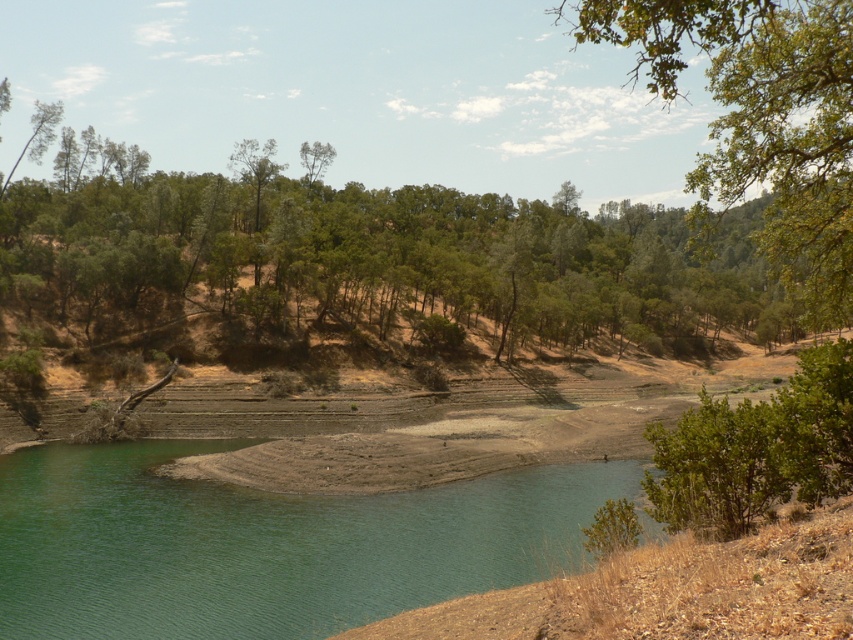
You are planning to plant a new tree in this landscape. The new tree requires a minimum of 300 feet of space between it and the nearest water source to prevent root damage. You have two options for planting locations near the green leafy tree at upper center and the green smooth water at lower left. Which location would be suitable for planting the new tree?

The green leafy tree at upper center and green smooth water at lower left are 305.01 feet apart. Since the required minimum distance is 300 feet, planting the new tree near the green leafy tree at upper center would be suitable because it is sufficiently far from the green smooth water at lower left to prevent root damage.

You are standing at the point marked by the coordinates point [403,253] in the image. Looking around, what type of vegetation do you see immediately around you?

The point [403,253] marks a green leafy tree at upper center, so you are surrounded by the green leafy tree.

From the picture: You are a hiker standing at the edge of the green smooth water at lower left, looking towards the green leafy tree at upper center. Which direction should you walk to reach the tree?

The green leafy tree at upper center is located in the upper part of the image, so you should walk towards the upper direction to reach it from the green smooth water at lower left.